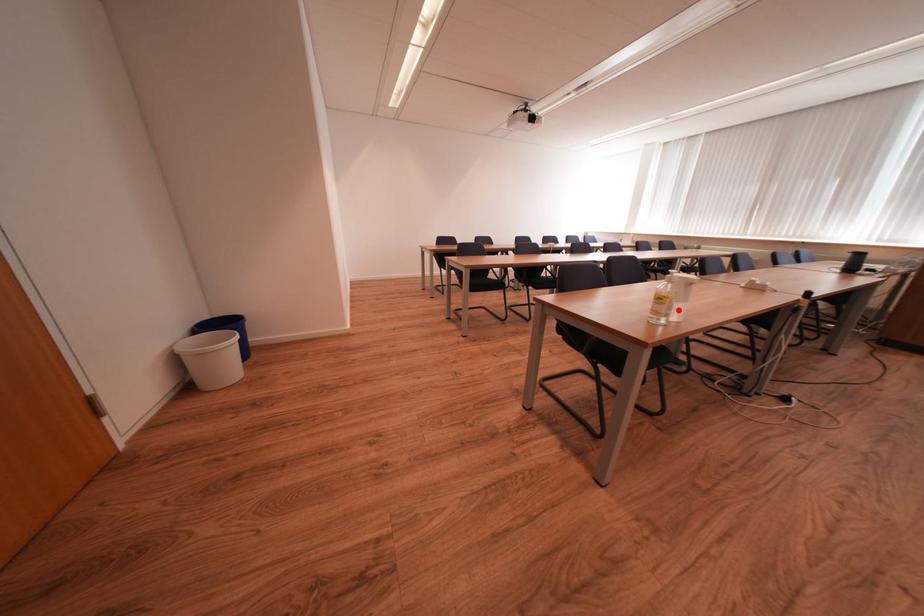
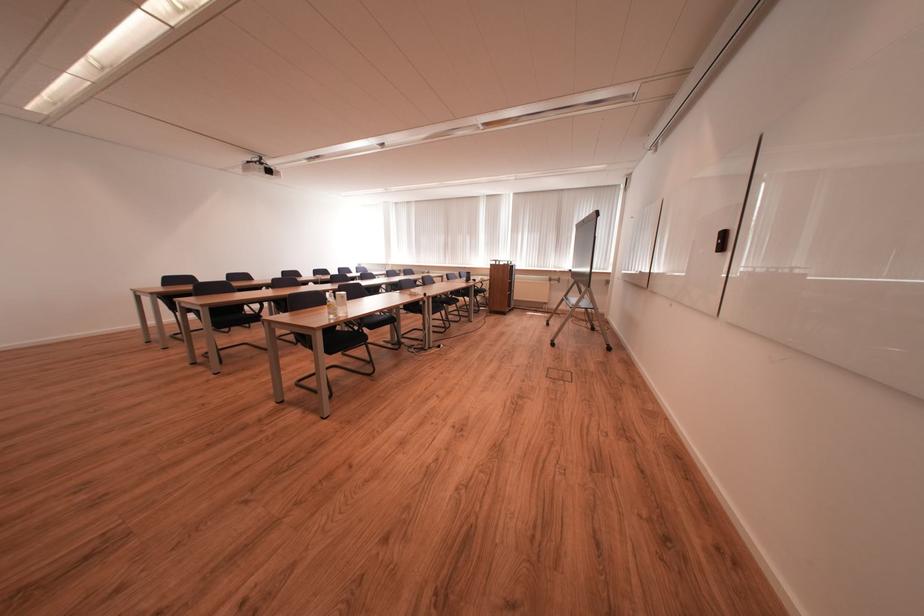
Question: A red point is marked in image1. In image2, is the corresponding 3D point closer to the camera or farther? Reply with the corresponding letter.

Choices:
 (A) The corresponding 3D point is closer.
 (B) The corresponding 3D point is farther.

Answer: (A)